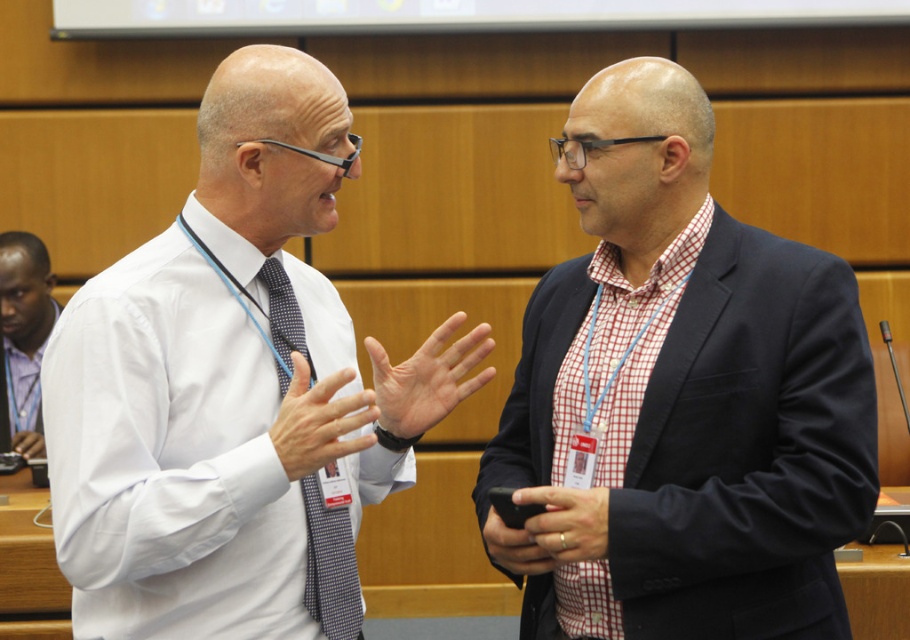
Question: Does red checkered shirt at center have a greater width compared to matte blue checkered tie at center?

Choices:
 (A) yes
 (B) no

Answer: (A)

Question: Which object appears farthest from the camera in this image?

Choices:
 (A) red checkered shirt at center
 (B) purple checkered shirt at left
 (C) white shirt at center
 (D) matte blue checkered tie at center

Answer: (B)

Question: Is red checkered shirt at center further to the viewer compared to purple checkered shirt at left?

Choices:
 (A) no
 (B) yes

Answer: (A)

Question: Which of the following is the closest to the observer?

Choices:
 (A) red checkered shirt at center
 (B) white shirt at center
 (C) matte blue checkered tie at center

Answer: (B)

Question: Does red checkered shirt at center have a larger size compared to white shirt at center?

Choices:
 (A) no
 (B) yes

Answer: (A)

Question: Among these objects, which one is nearest to the camera?

Choices:
 (A) purple checkered shirt at left
 (B) white shirt at center
 (C) red checkered shirt at center

Answer: (B)